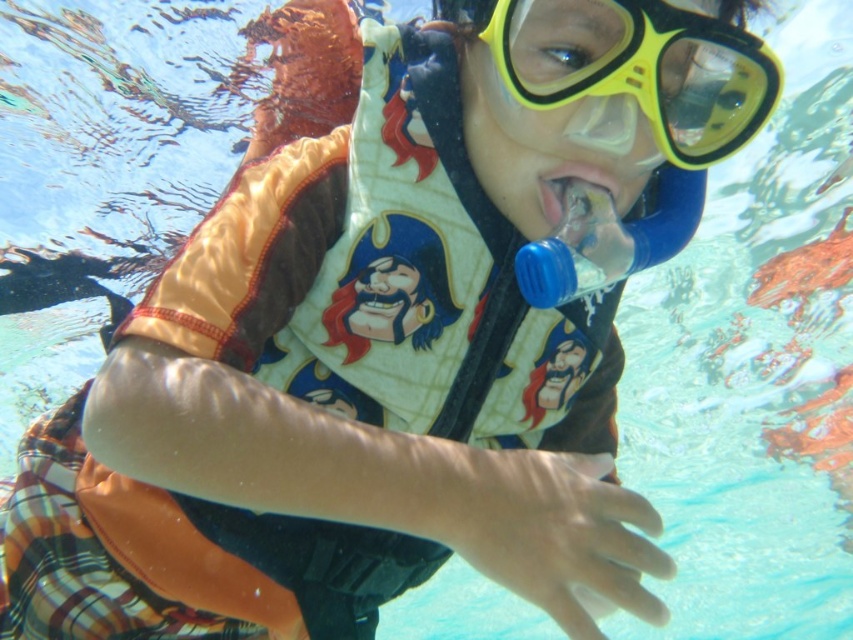
Question: Which point appears farthest from the camera in this image?

Choices:
 (A) (643, 259)
 (B) (637, 96)

Answer: (A)

Question: Which object is farther from the camera taking this photo?

Choices:
 (A) blue plastic bottle at center
 (B) translucent plastic mouth at center
 (C) yellow matte snorkel mask at upper center

Answer: (B)

Question: Where is yellow matte snorkel mask at upper center located in relation to translucent plastic mouth at center in the image?

Choices:
 (A) left
 (B) right

Answer: (B)

Question: Is yellow matte snorkel mask at upper center to the right of translucent plastic mouth at center from the viewer's perspective?

Choices:
 (A) yes
 (B) no

Answer: (A)

Question: Does yellow matte snorkel mask at upper center appear on the left side of blue plastic bottle at center?

Choices:
 (A) yes
 (B) no

Answer: (A)

Question: Among these objects, which one is farthest from the camera?

Choices:
 (A) blue plastic bottle at center
 (B) translucent plastic mouth at center
 (C) yellow matte snorkel mask at upper center

Answer: (B)